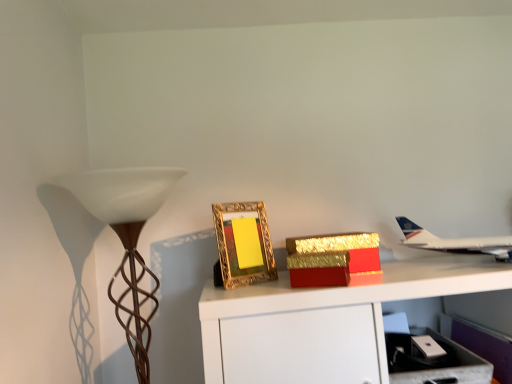
Question: Choose the correct answer: Is brown textured lamp at left inside gold ornate frame at center or outside it?

Choices:
 (A) inside
 (B) outside

Answer: (B)

Question: From the image's perspective, is brown textured lamp at left located above or below gold ornate frame at center?

Choices:
 (A) below
 (B) above

Answer: (A)

Question: Estimate the real-world distances between objects in this image. Which object is closer to the gold glittery box at center?

Choices:
 (A) gold ornate frame at center
 (B) brown textured lamp at left
 (C) metallic silver drawer at lower right
 (D) gold cardboard box at center
 (E) white metallic airplane at upper right

Answer: (D)

Question: Based on their relative distances, which object is farther from the gold glittery box at center?

Choices:
 (A) gold cardboard box at center
 (B) metallic silver drawer at lower right
 (C) gold ornate frame at center
 (D) white metallic airplane at upper right
 (E) brown textured lamp at left

Answer: (E)